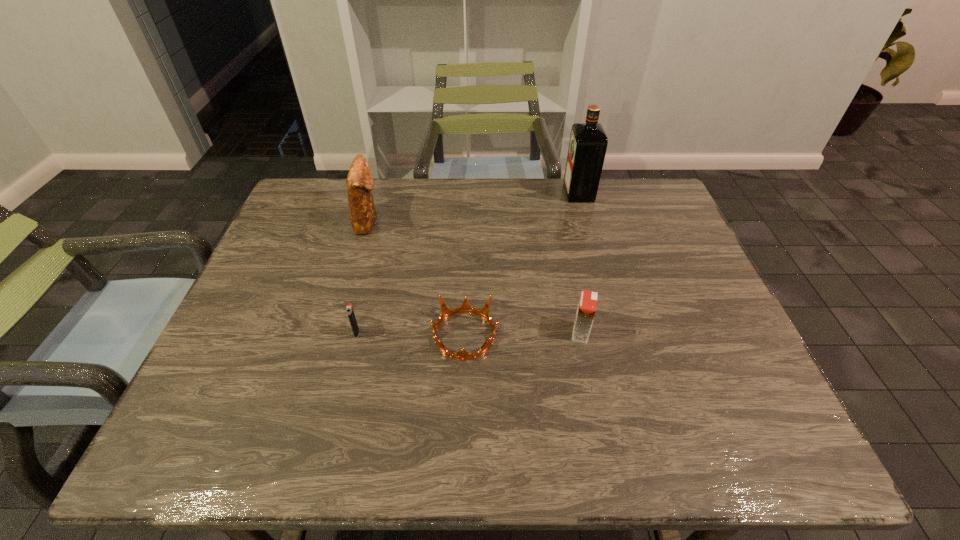
The width and height of the screenshot is (960, 540). I want to click on the tallest object, so [588, 143].

The height and width of the screenshot is (540, 960). What are the coordinates of `the rightmost object` in the screenshot? It's located at pos(588,143).

Find the location of a particular element. The image size is (960, 540). clutch bag is located at coordinates (359, 181).

You are a GUI agent. You are given a task and a screenshot of the screen. Output one action in this format:
    pyautogui.click(x=<x>, y=<y>)
    Task: Click on the second tallest object
    This screenshot has width=960, height=540.
    Given the screenshot: What is the action you would take?
    pyautogui.click(x=359, y=181)

I want to click on the second object from right to left, so click(x=586, y=310).

At what (x,y) coordinates should I click in order to perform the action: click on orange juice. Please return your answer as a coordinate pair (x, y). Looking at the image, I should click on (586, 310).

This screenshot has height=540, width=960. I want to click on the fourth tallest object, so click(x=349, y=309).

Where is `igniter`? The height and width of the screenshot is (540, 960). igniter is located at coordinates (349, 309).

The width and height of the screenshot is (960, 540). I want to click on the third object from right to left, so click(x=465, y=307).

The height and width of the screenshot is (540, 960). I want to click on crown, so click(x=465, y=307).